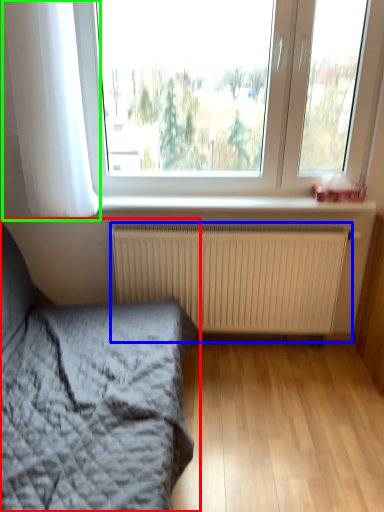
Question: Which is nearer to the bed (highlighted by a red box)? radiator (highlighted by a blue box) or curtain (highlighted by a green box).

Choices:
 (A) radiator
 (B) curtain

Answer: (A)